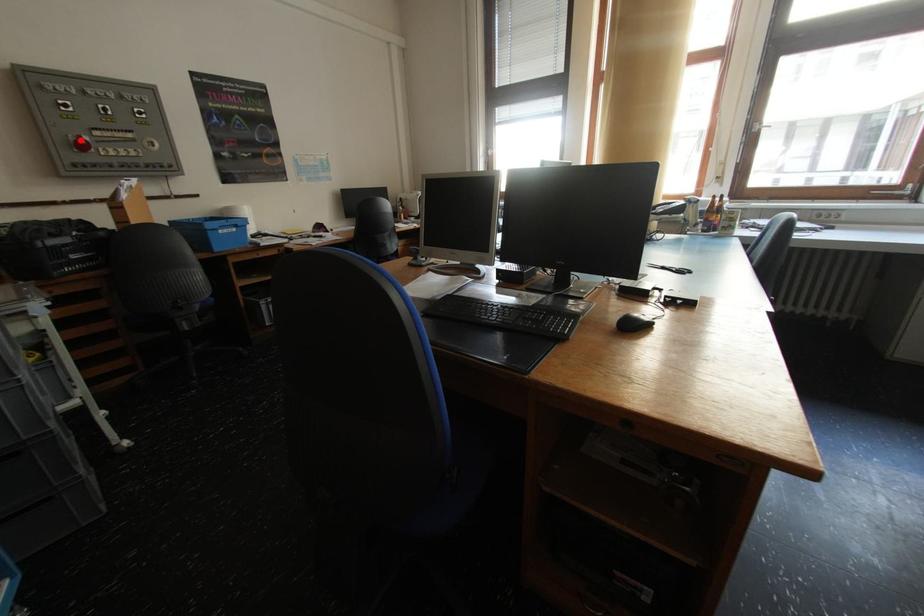
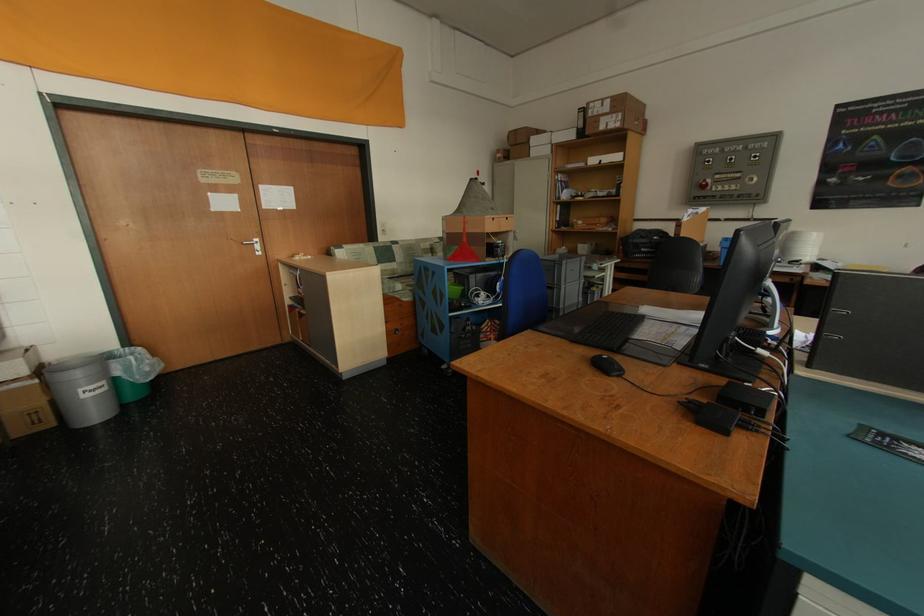
The point at the highlighted location is marked in the first image. Where is the corresponding point in the second image?

(709, 183)